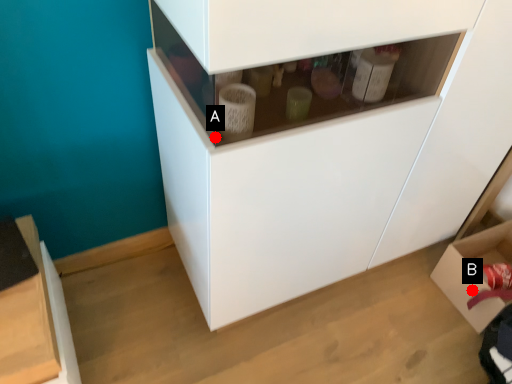
Question: Two points are circled on the image, labeled by A and B beside each circle. Among these points, which one is nearest to the camera?

Choices:
 (A) A is closer
 (B) B is closer

Answer: (A)